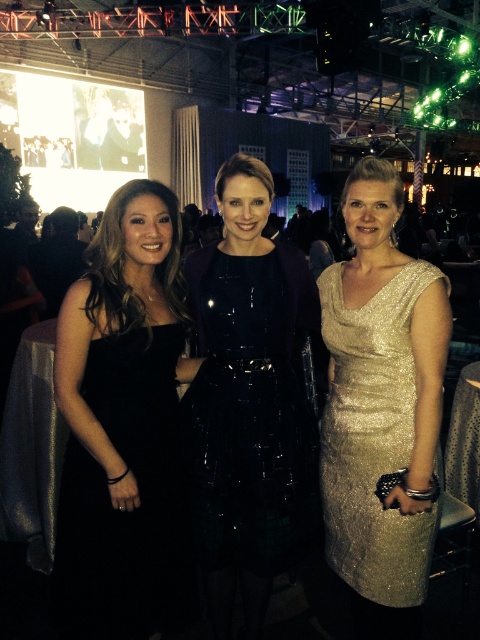
Looking at this image, who is positioned more to the right, black satin dress at left or glossy black dress at center?

glossy black dress at center

Is point (178, 456) behind point (276, 492)?

That is True.

At what (x,y) coordinates should I click in order to perform the action: click on black satin dress at left. Please return your answer as a coordinate pair (x, y). Looking at the image, I should click on (123, 428).

Which is above, black satin dress at left or gold sequined dress at right?

black satin dress at left is above.

Which is more to the left, black satin dress at left or gold sequined dress at right?

From the viewer's perspective, black satin dress at left appears more on the left side.

Is point (171, 244) closer to viewer compared to point (345, 454)?

That is True.

Where is `black satin dress at left`? black satin dress at left is located at coordinates (123, 428).

In the scene shown: Is glossy black dress at center further to camera compared to gold sequined dress at right?

Yes.

Does point (238, 289) come behind point (344, 433)?

No.

Is point (248, 180) positioned in front of point (408, 356)?

Yes.

Locate an element on the screen. glossy black dress at center is located at coordinates (249, 403).